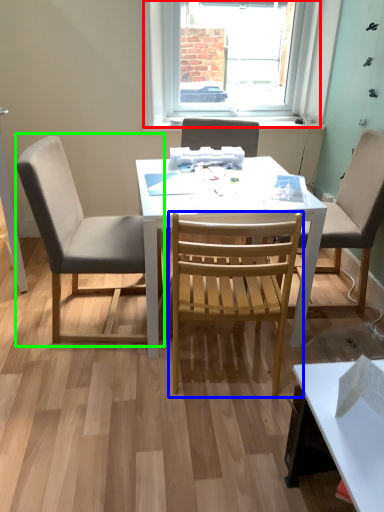
Question: Considering the real-world distances, which object is closest to window (highlighted by a red box)? chair (highlighted by a blue box) or chair (highlighted by a green box).

Choices:
 (A) chair
 (B) chair

Answer: (B)